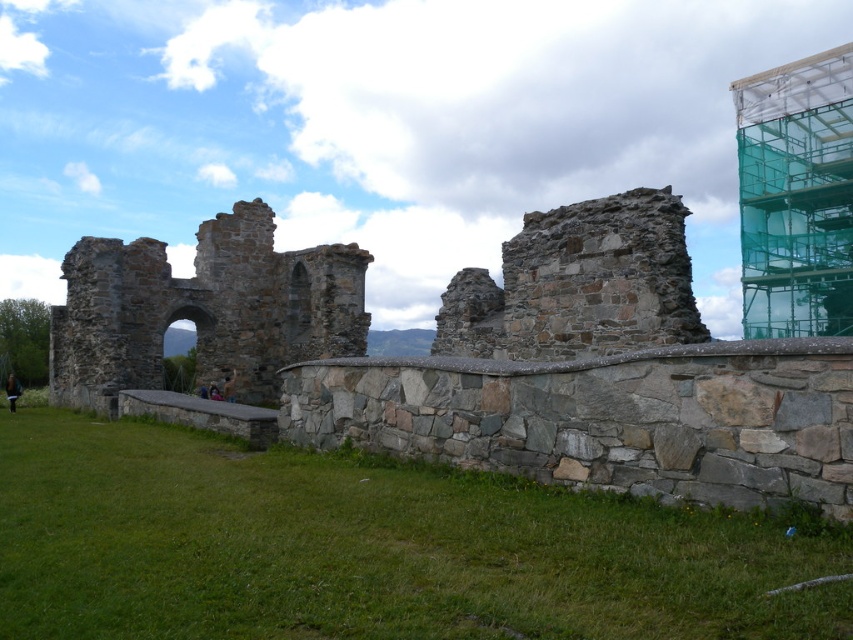
You are a tour guide explaining the historical site to visitors. You point out the stone wall at center and the stone arch at center. Which structure is taller?

The stone arch at center is taller than the stone wall at center.

You are a tour guide explaining the historical stone structure to visitors. You point out the stone arch at center and the green mesh scaffolding at upper right. Which one is nearer to the visitors?

The stone arch at center is closer to the visitors than the green mesh scaffolding at upper right.